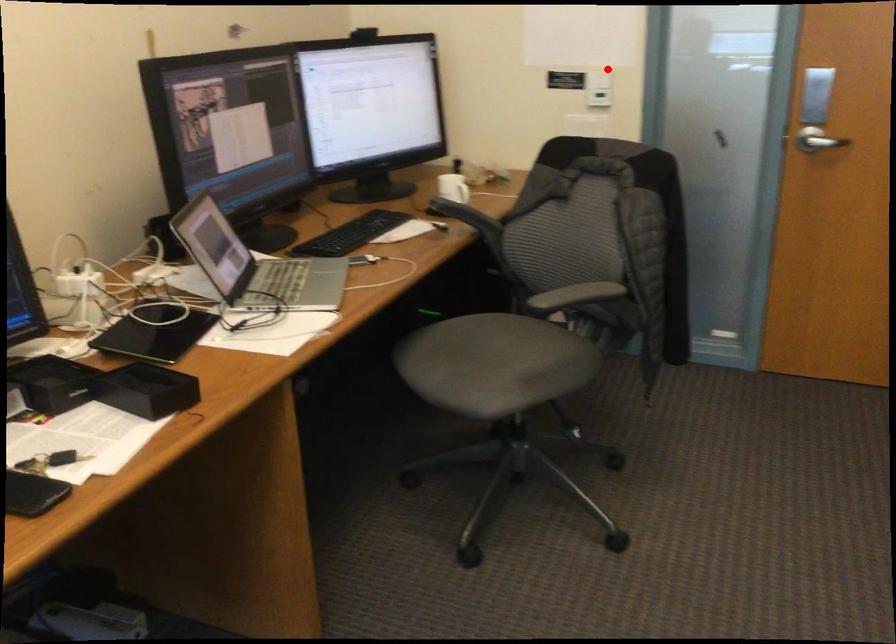
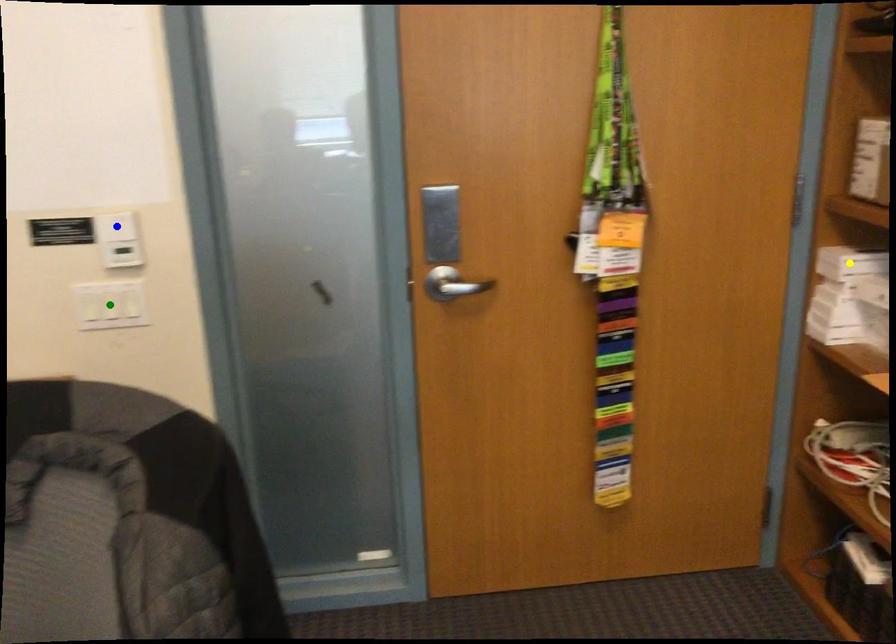
Question: I am providing you with two images of the same scene from different viewpoints. A red point is marked on the first image. You are given multiple points on the second image. In image 2, which mark is for the same physical point as the one in image 1?

Choices:
 (A) blue point
 (B) yellow point
 (C) green point

Answer: (A)